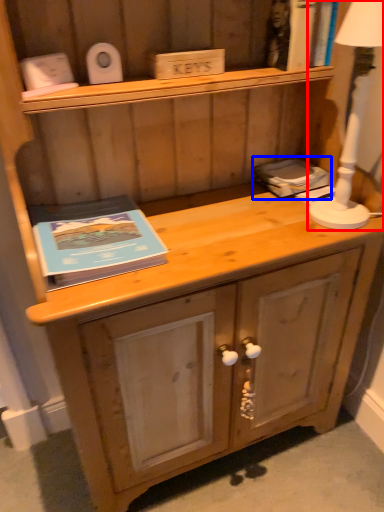
Question: Which point is further to the camera, bedside lamp (highlighted by a red box) or book (highlighted by a blue box)?

Choices:
 (A) bedside lamp
 (B) book

Answer: (B)